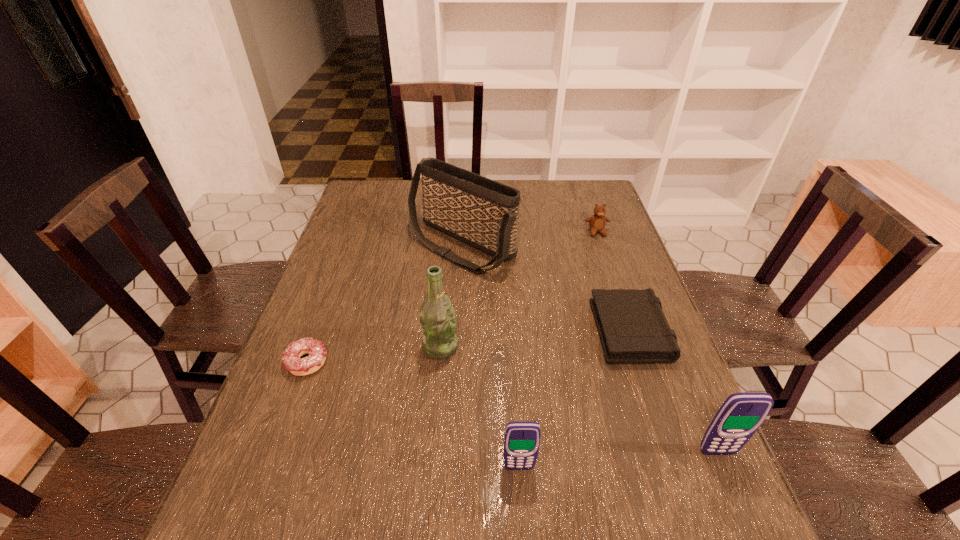
At what (x,y) coordinates should I click in order to perform the action: click on the nearest object. Please return your answer as a coordinate pair (x, y). This screenshot has width=960, height=540. Looking at the image, I should click on pos(521,439).

I want to click on the fourth tallest object, so click(521, 439).

Image resolution: width=960 pixels, height=540 pixels. I want to click on the second nearest object, so click(741, 414).

At what (x,y) coordinates should I click in order to perform the action: click on the farther cellular telephone. Please return your answer as a coordinate pair (x, y). The image size is (960, 540). Looking at the image, I should click on (741, 414).

Locate an element on the screen. the third shortest object is located at coordinates (597, 222).

Image resolution: width=960 pixels, height=540 pixels. Identify the location of beer bottle. (437, 318).

Locate an element on the screen. This screenshot has width=960, height=540. handbag is located at coordinates (481, 212).

Where is `the leftmost object`? This screenshot has width=960, height=540. the leftmost object is located at coordinates (291, 358).

You are a GUI agent. You are given a task and a screenshot of the screen. Output one action in this format:
    pyautogui.click(x=<x>, y=<y>)
    Task: Click on the doughnut
    Image resolution: width=960 pixels, height=540 pixels.
    Given the screenshot: What is the action you would take?
    pyautogui.click(x=291, y=358)

In order to click on the second shortest object in this screenshot , I will do `click(632, 326)`.